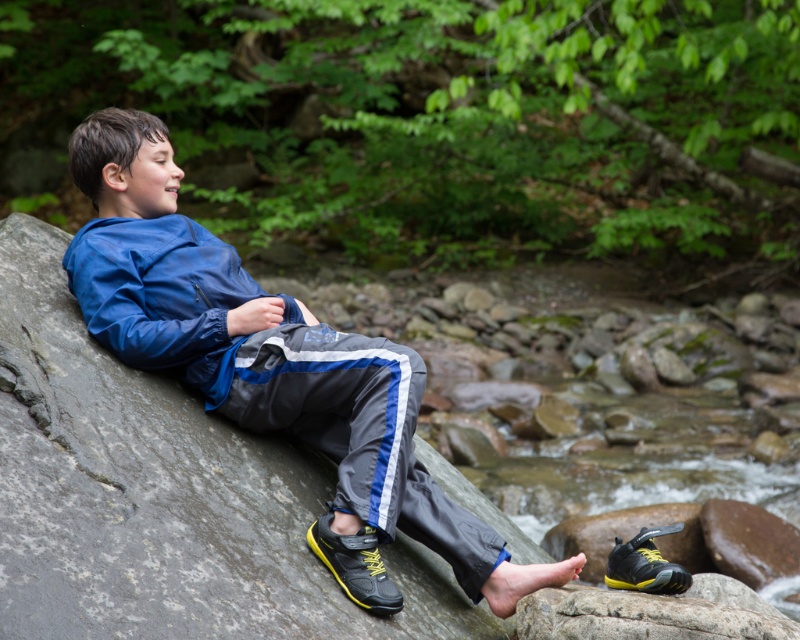
You are a fashion designer analyzing clothing items in a forest scene. You notice the matte blue jacket at center and the blue synthetic jacket at upper left. Which jacket appears to be larger in height when viewed from your perspective?

The matte blue jacket at center is taller than the blue synthetic jacket at upper left, so the matte blue jacket at center appears larger in height.

You are a drone operator trying to capture a photo of the boy in the forest. You have two points marked on your screen for camera positioning. The first point is at coordinates point [360,588] and the second is at point [618,586]. Which point should you choose to get a closer shot of the boy?

Point [360,588] is closer to the viewer than point [618,586], so you should choose point [360,588] to get a closer shot of the boy.